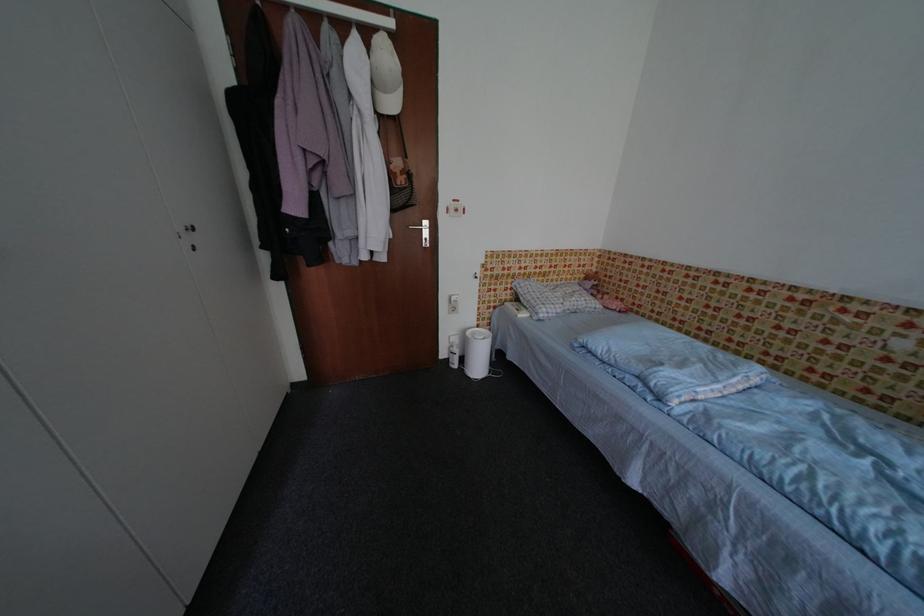
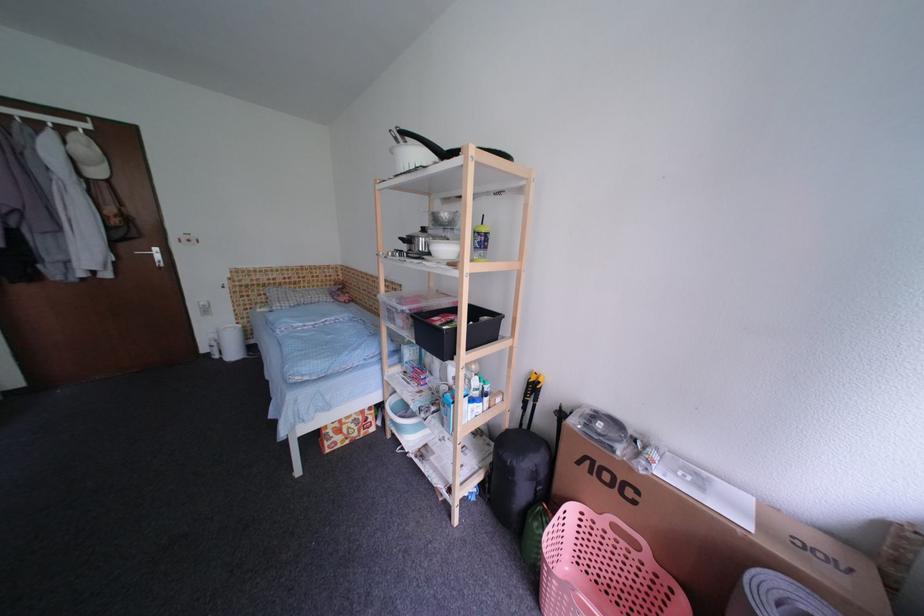
In a continuous first-person perspective shot, in which direction is the camera moving?

The cameraman moved toward right, backward.